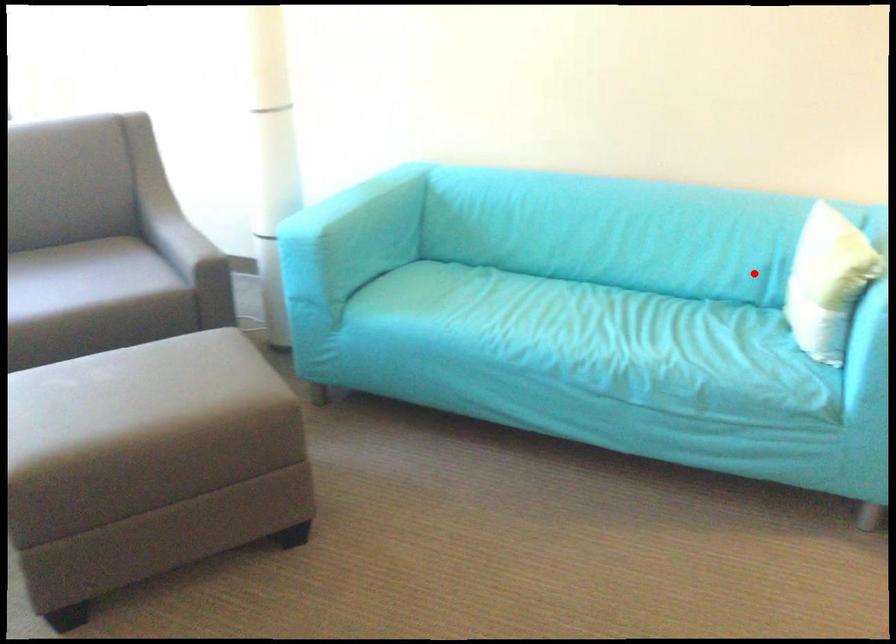
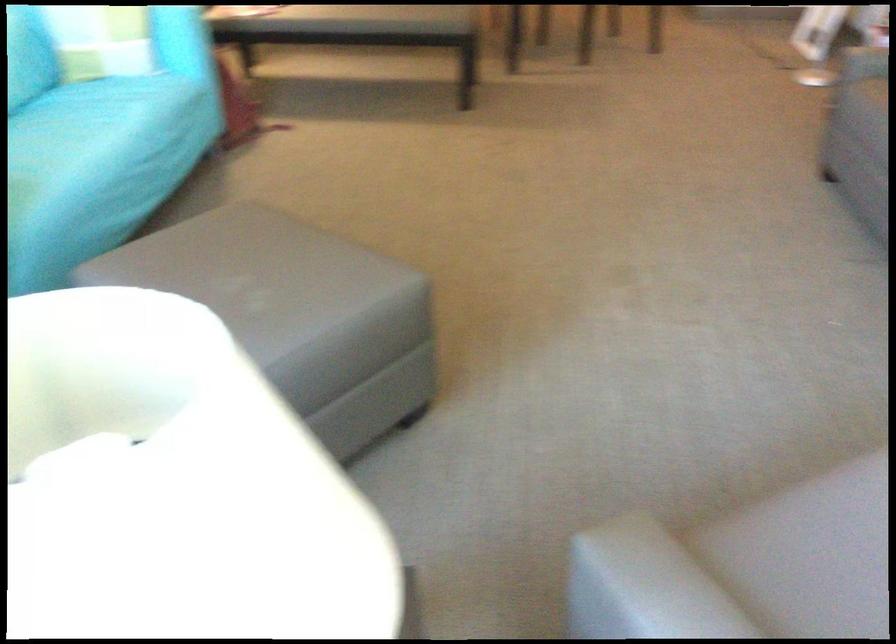
Locate, in the second image, the point that corresponds to the highlighted location in the first image.

(101, 29)